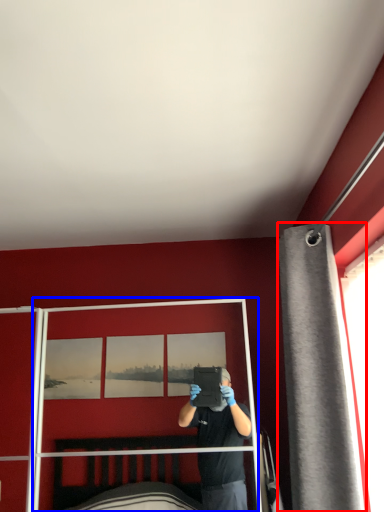
Question: Which of the following is the farthest to the observer, curtain (highlighted by a red box) or screen door (highlighted by a blue box)?

Choices:
 (A) curtain
 (B) screen door

Answer: (B)